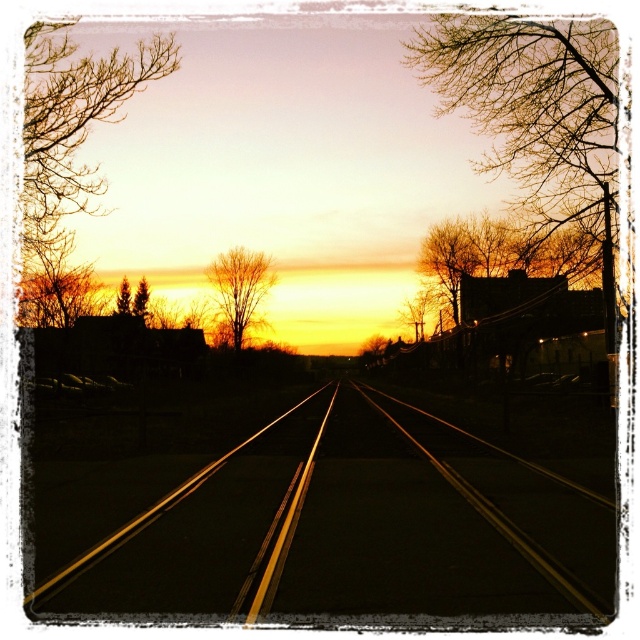
Question: Is green matte tree at upper left positioned in front of green matte tree at left?

Choices:
 (A) no
 (B) yes

Answer: (A)

Question: Which object is farther from the camera taking this photo?

Choices:
 (A) bare branches at center
 (B) bare branches at upper right
 (C) metal/yellowishobject at center
 (D) green matte tree at upper left

Answer: (A)

Question: Where is bare branches at center located in relation to green matte tree at upper left in the image?

Choices:
 (A) above
 (B) below

Answer: (A)

Question: Which point is farther to the camera?

Choices:
 (A) (145, 284)
 (B) (122, 284)
 (C) (404, 541)

Answer: (A)

Question: Can you confirm if green matte tree at upper left is positioned to the right of green matte tree at left?

Choices:
 (A) no
 (B) yes

Answer: (B)

Question: Which object appears farthest from the camera in this image?

Choices:
 (A) green matte tree at upper left
 (B) green matte tree at left
 (C) bare branches at upper right
 (D) metal/yellowishobject at center

Answer: (A)